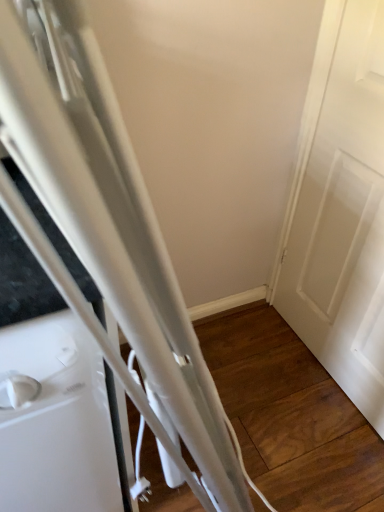
Describe the element at coordinates (23, 281) in the screenshot. This screenshot has height=512, width=384. I see `white glossy refrigerator at left` at that location.

Identify the location of white glossy refrigerator at left. (23, 281).

This screenshot has width=384, height=512. What do you see at coordinates (344, 219) in the screenshot?
I see `white matte door at right` at bounding box center [344, 219].

This screenshot has width=384, height=512. I want to click on white matte door at right, so click(344, 219).

The height and width of the screenshot is (512, 384). Identify the location of white glossy refrigerator at left. (23, 281).

Is white matte door at right to the left of white glossy refrigerator at left from the viewer's perspective?

No, white matte door at right is not to the left of white glossy refrigerator at left.

Relative to white glossy refrigerator at left, is white matte door at right in front or behind?

In the image, white matte door at right appears behind white glossy refrigerator at left.

Is point (357, 267) farther from viewer compared to point (65, 310)?

That is True.

From the image's perspective, is white matte door at right under white glossy refrigerator at left?

No, from the image's perspective, white matte door at right is not beneath white glossy refrigerator at left.

From a real-world perspective, which object stands above the other?

white matte door at right is physically above.

Which of these two, white matte door at right or white glossy refrigerator at left, is wider?

Wider between the two is white glossy refrigerator at left.

Can you confirm if white matte door at right is shorter than white glossy refrigerator at left?

No, white matte door at right is not shorter than white glossy refrigerator at left.

Considering the relative sizes of white matte door at right and white glossy refrigerator at left in the image provided, is white matte door at right bigger than white glossy refrigerator at left?

Actually, white matte door at right might be smaller than white glossy refrigerator at left.

Is white matte door at right inside the boundaries of white glossy refrigerator at left, or outside?

white matte door at right lies outside white glossy refrigerator at left.

Is white matte door at right next to white glossy refrigerator at left and touching it?

white matte door at right and white glossy refrigerator at left are not in contact.

Is white matte door at right turned away from white glossy refrigerator at left?

No, white matte door at right is not facing the opposite direction of white glossy refrigerator at left.

How many degrees apart are the facing directions of white matte door at right and white glossy refrigerator at left?

The angle between the facing direction of white matte door at right and the facing direction of white glossy refrigerator at left is 91.6 degrees.

Locate an element on the screen. This screenshot has height=512, width=384. appliance on the left side of white matte door at right is located at coordinates (23, 281).

Consider the image. Considering the positions of objects white glossy refrigerator at left and white matte door at right in the image provided, who is more to the left, white glossy refrigerator at left or white matte door at right?

→ Positioned to the left is white glossy refrigerator at left.

Is white glossy refrigerator at left in front of white matte door at right?

Yes, white glossy refrigerator at left is closer to the camera.

Considering the points (112, 420) and (355, 142), which point is in front, point (112, 420) or point (355, 142)?

Point (112, 420)

From the image's perspective, which is below, white glossy refrigerator at left or white matte door at right?

white glossy refrigerator at left appears lower in the image.

From a real-world perspective, is white glossy refrigerator at left above or below white matte door at right?

white glossy refrigerator at left is situated lower than white matte door at right in the real world.

Can you confirm if white glossy refrigerator at left is wider than white matte door at right?

Yes.

Considering the sizes of white glossy refrigerator at left and white matte door at right in the image, is white glossy refrigerator at left taller or shorter than white matte door at right?

Considering their sizes, white glossy refrigerator at left has less height than white matte door at right.

Between white glossy refrigerator at left and white matte door at right, which one has smaller size?

white matte door at right.

Based on the photo, which is correct: white glossy refrigerator at left is inside white matte door at right, or outside of it?

white glossy refrigerator at left exists outside the volume of white matte door at right.

Are white glossy refrigerator at left and white matte door at right far apart?

No.

Looking at this image, could you tell me if white glossy refrigerator at left is turned towards white matte door at right?

No, white glossy refrigerator at left is not aimed at white matte door at right.

How far apart are white glossy refrigerator at left and white matte door at right?

34.46 inches.

Identify the location of appliance to the left of white matte door at right. The width and height of the screenshot is (384, 512). click(23, 281).

The height and width of the screenshot is (512, 384). Identify the location of appliance lying on the left of white matte door at right. (23, 281).

Find the location of `door that appears on the right of white glossy refrigerator at left`. door that appears on the right of white glossy refrigerator at left is located at coordinates (344, 219).